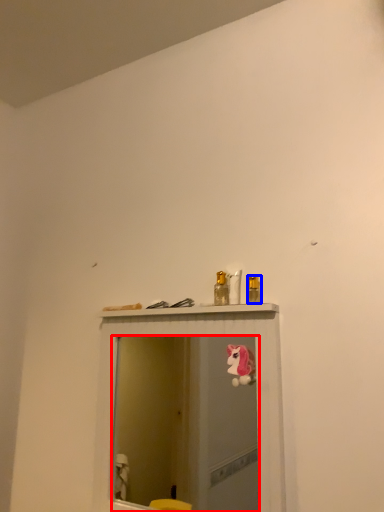
Question: Which point is closer to the camera, mirror (highlighted by a red box) or toiletry (highlighted by a blue box)?

Choices:
 (A) mirror
 (B) toiletry

Answer: (A)